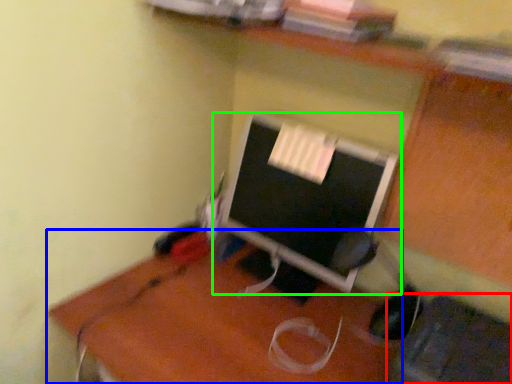
Question: Considering the real-world distances, which object is farthest from computer chair (highlighted by a red box)? desk (highlighted by a blue box) or computer monitor (highlighted by a green box)?

Choices:
 (A) desk
 (B) computer monitor

Answer: (B)